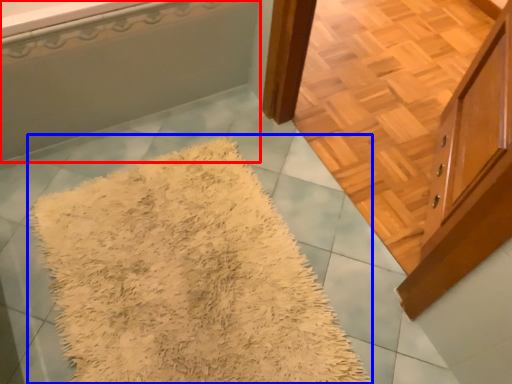
Question: Which object appears farthest to the camera in this image, bathtub (highlighted by a red box) or mat (highlighted by a blue box)?

Choices:
 (A) bathtub
 (B) mat

Answer: (A)